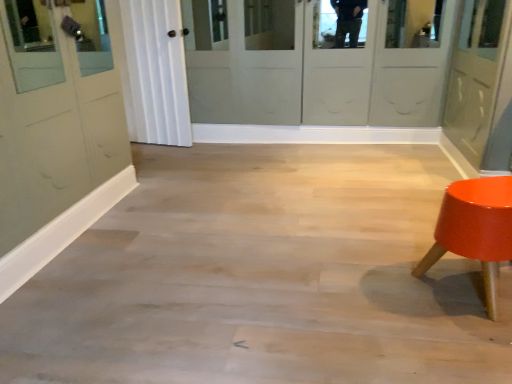
Question: In the image, is shiny orange stool at right on the left side or the right side of matte gray door at right?

Choices:
 (A) right
 (B) left

Answer: (B)

Question: Based on their sizes in the image, would you say shiny orange stool at right is bigger or smaller than matte gray door at right?

Choices:
 (A) small
 (B) big

Answer: (A)

Question: From the image's perspective, is shiny orange stool at right positioned above or below matte gray door at right?

Choices:
 (A) above
 (B) below

Answer: (B)

Question: Considering their positions, is matte gray door at right located in front of or behind shiny orange stool at right?

Choices:
 (A) behind
 (B) front

Answer: (A)

Question: Is point (490, 110) closer or farther from the camera than point (501, 238)?

Choices:
 (A) farther
 (B) closer

Answer: (A)

Question: Considering the positions of matte gray door at right and shiny orange stool at right in the image, is matte gray door at right wider or thinner than shiny orange stool at right?

Choices:
 (A) thin
 (B) wide

Answer: (B)

Question: Choose the correct answer: Is matte gray door at right inside shiny orange stool at right or outside it?

Choices:
 (A) outside
 (B) inside

Answer: (A)